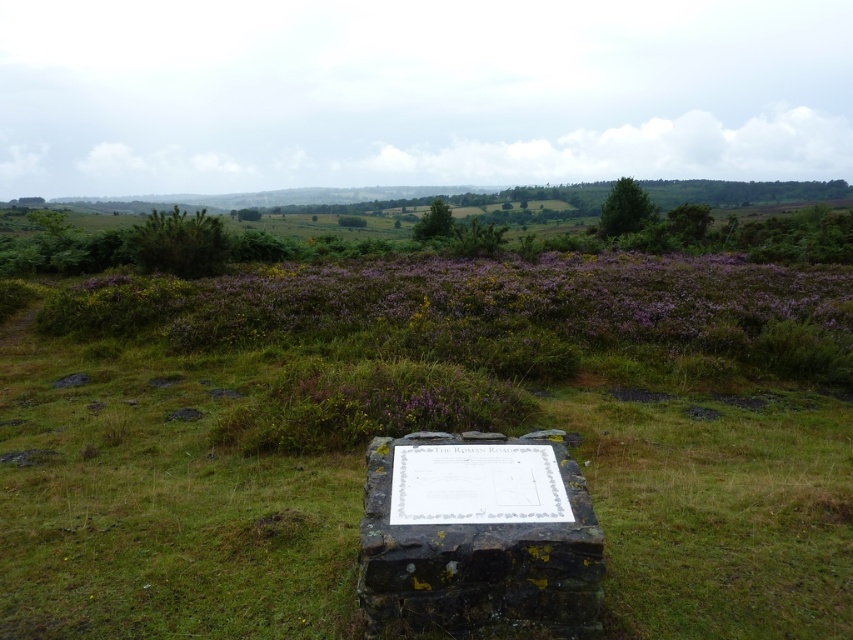
Question: Which point appears closest to the camera in this image?

Choices:
 (A) (386, 612)
 (B) (86, 332)

Answer: (A)

Question: Does purple matte heather at upper center appear on the left side of dark gray stone marker at center?

Choices:
 (A) no
 (B) yes

Answer: (A)

Question: Which point appears farthest from the camera in this image?

Choices:
 (A) (177, 285)
 (B) (521, 579)

Answer: (A)

Question: Can you confirm if purple matte heather at upper center is bigger than dark gray stone marker at center?

Choices:
 (A) yes
 (B) no

Answer: (A)

Question: Which point is closer to the camera?

Choices:
 (A) (459, 572)
 (B) (358, 314)

Answer: (A)

Question: Can you confirm if purple matte heather at upper center is smaller than dark gray stone marker at center?

Choices:
 (A) no
 (B) yes

Answer: (A)